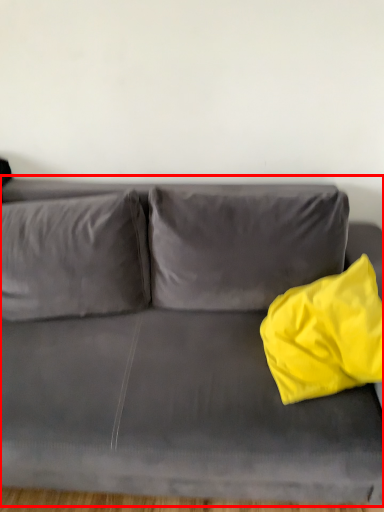
Question: Considering the relative positions of studio couch (annotated by the red box) and throw pillow in the image provided, where is studio couch (annotated by the red box) located with respect to the staircase?

Choices:
 (A) left
 (B) right

Answer: (A)